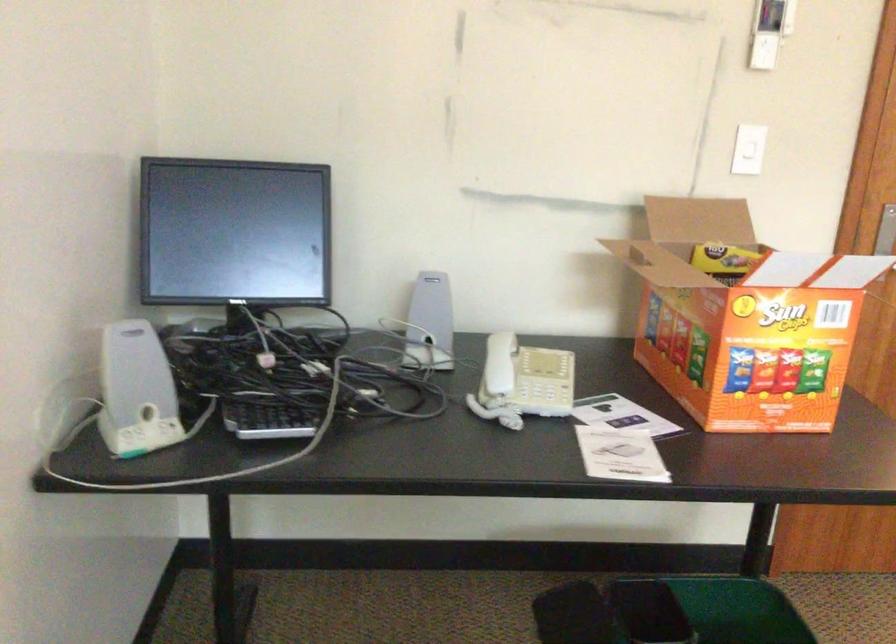
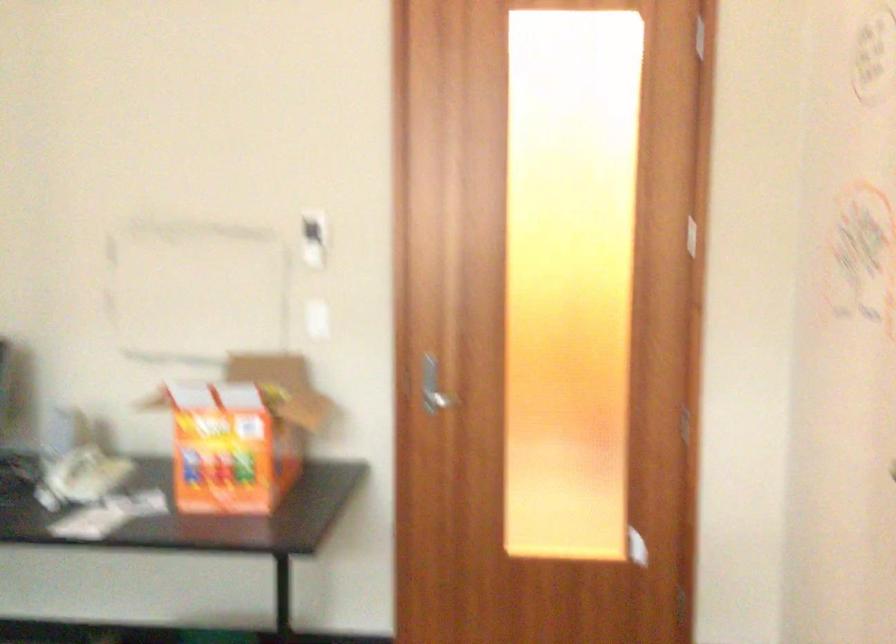
The images are taken continuously from a first-person perspective. In which direction are you moving?

The movement direction of the cameraman is right, backward.